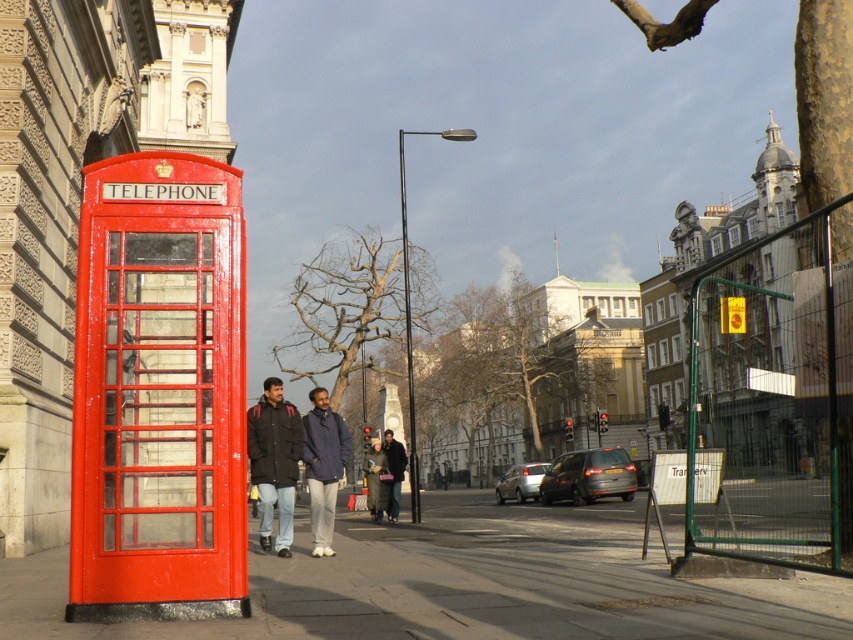
Which of these two, dark brown leather jacket at center or dark gray wool coat at center, stands taller?

With more height is dark brown leather jacket at center.

Is dark brown leather jacket at center below dark gray wool coat at center?

Incorrect, dark brown leather jacket at center is not positioned below dark gray wool coat at center.

Where is `dark brown leather jacket at center`? The width and height of the screenshot is (853, 640). dark brown leather jacket at center is located at coordinates (274, 461).

Is blue fabric jacket at center further to the viewer compared to dark gray wool coat at center?

No, blue fabric jacket at center is in front of dark gray wool coat at center.

Is point (306, 451) behind point (399, 465)?

No, (306, 451) is closer to viewer.

Identify the location of blue fabric jacket at center. (323, 467).

Can you confirm if dark brown leather jacket at center is bigger than blue fabric jacket at center?

Incorrect, dark brown leather jacket at center is not larger than blue fabric jacket at center.

Is dark brown leather jacket at center to the right of blue fabric jacket at center from the viewer's perspective?

Correct, you'll find dark brown leather jacket at center to the right of blue fabric jacket at center.

Between point (289, 518) and point (309, 426), which one is positioned behind?

Positioned behind is point (309, 426).

The width and height of the screenshot is (853, 640). What are the coordinates of `dark brown leather jacket at center` in the screenshot? It's located at (274, 461).